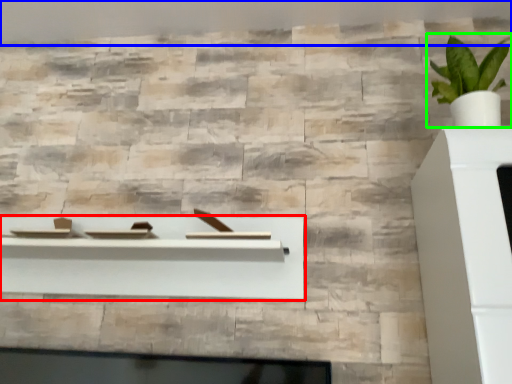
Question: Which object is the farthest from shelf (highlighted by a red box)? Choose among these: backdrop (highlighted by a blue box) or houseplant (highlighted by a green box).

Choices:
 (A) backdrop
 (B) houseplant

Answer: (A)